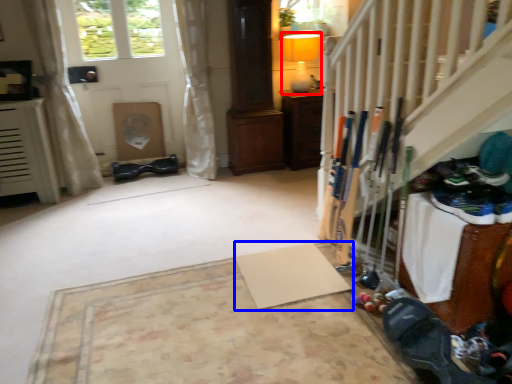
Question: Which object appears farthest to the camera in this image, lamp (highlighted by a red box) or yoga mat (highlighted by a blue box)?

Choices:
 (A) lamp
 (B) yoga mat

Answer: (A)